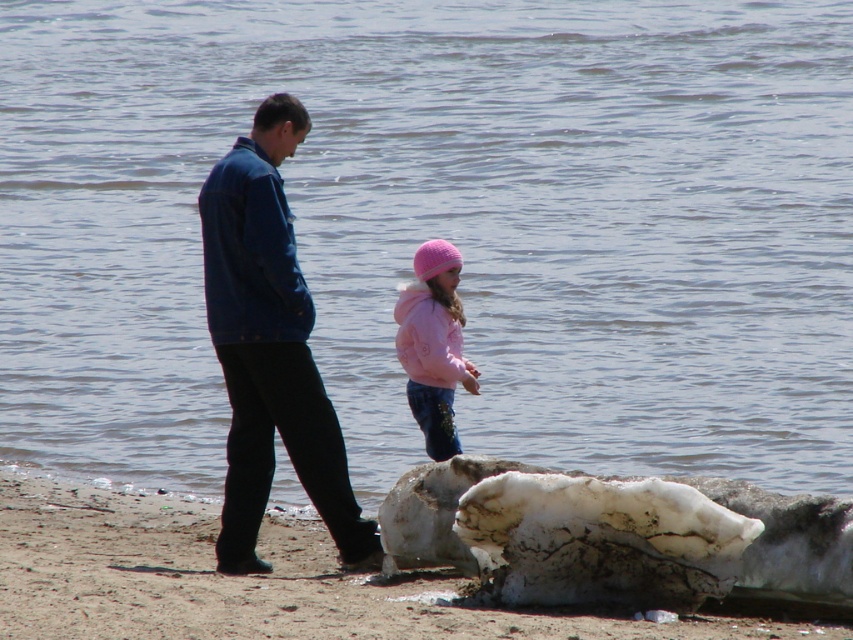
Question: Which of the following is the closest to the observer?

Choices:
 (A) pink fleece jacket at center
 (B) smooth sand at lower left
 (C) blue denim jacket at center

Answer: (B)

Question: Which object appears farthest from the camera in this image?

Choices:
 (A) blue denim jacket at center
 (B) smooth sand at lower left

Answer: (A)

Question: Which point is closer to the camera?

Choices:
 (A) pink fleece jacket at center
 (B) blue denim jacket at center

Answer: (B)

Question: Can you confirm if smooth sand at lower left is wider than blue denim jacket at center?

Choices:
 (A) yes
 (B) no

Answer: (B)

Question: Does smooth sand at lower left come behind pink fleece jacket at center?

Choices:
 (A) yes
 (B) no

Answer: (B)

Question: Does smooth sand at lower left have a smaller size compared to blue denim jacket at center?

Choices:
 (A) no
 (B) yes

Answer: (B)